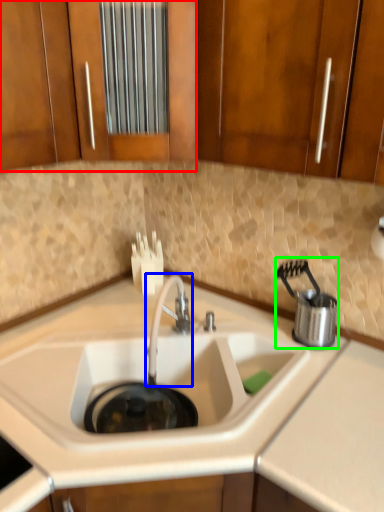
Question: Based on their relative distances, which object is nearer to cabinetry (highlighted by a red box)? Choose from tap (highlighted by a blue box) and appliance (highlighted by a green box).

Choices:
 (A) tap
 (B) appliance

Answer: (A)